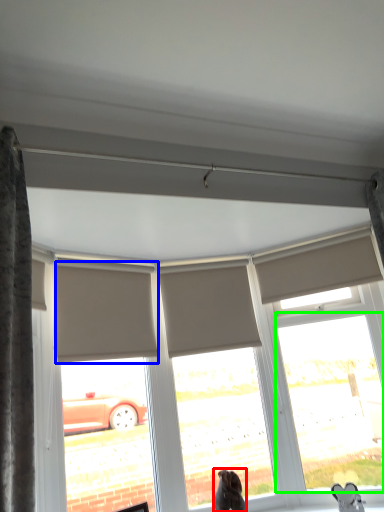
Question: Which object is the closest to the dog (highlighted by a red box)? Choose among these: shutter (highlighted by a blue box) or window (highlighted by a green box).

Choices:
 (A) shutter
 (B) window

Answer: (B)